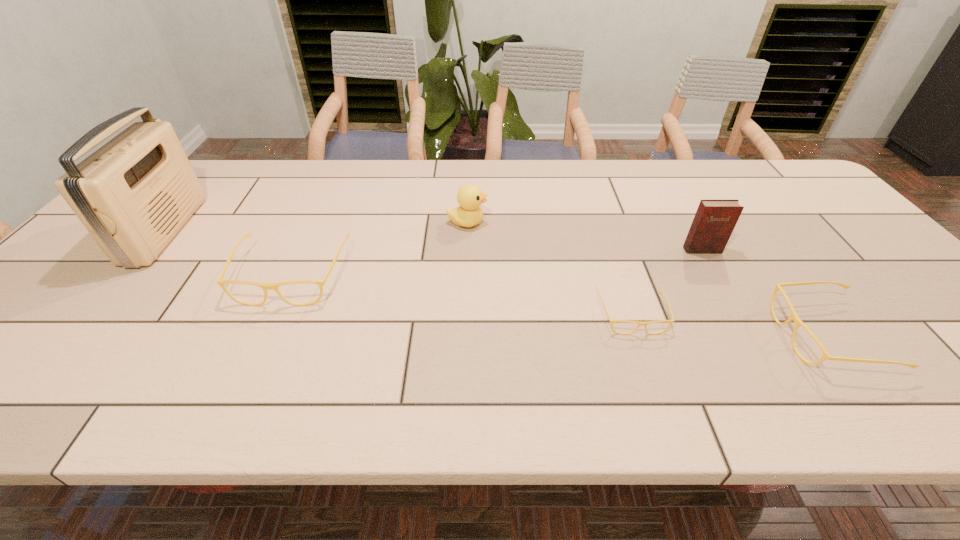
Locate an element on the screen. The image size is (960, 540). the fifth object from right to left is located at coordinates (265, 286).

You are a GUI agent. You are given a task and a screenshot of the screen. Output one action in this format:
    pyautogui.click(x=<x>, y=<y>)
    Task: Click on the shortest spectacles
    Image resolution: width=960 pixels, height=540 pixels.
    Given the screenshot: What is the action you would take?
    pyautogui.click(x=644, y=324)

The width and height of the screenshot is (960, 540). What are the coordinates of `the second spectacles from left to right` in the screenshot? It's located at (644, 324).

Find the location of a particular element. The image size is (960, 540). the fifth tallest object is located at coordinates (794, 317).

This screenshot has height=540, width=960. Identify the location of the rightmost spectacles. (794, 317).

This screenshot has width=960, height=540. What are the coordinates of `the tallest object` in the screenshot? It's located at (133, 194).

Locate an element on the screen. This screenshot has height=540, width=960. radio receiver is located at coordinates (133, 194).

I want to click on the second tallest object, so click(x=714, y=221).

Find the location of a particular element. The height and width of the screenshot is (540, 960). the second object from right to left is located at coordinates (x=714, y=221).

Identify the location of the fourth shortest object. tap(470, 197).